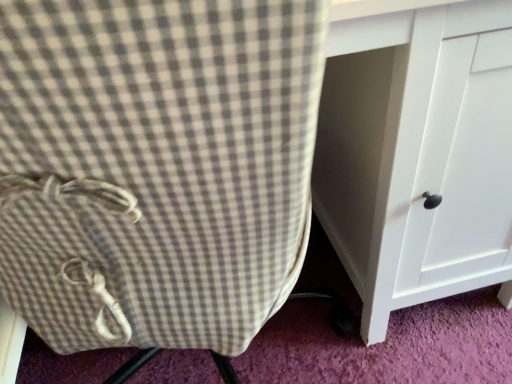
Describe the element at coordinates (464, 172) in the screenshot. I see `white matte drawer at right` at that location.

Where is `white matte drawer at right`? The height and width of the screenshot is (384, 512). white matte drawer at right is located at coordinates (464, 172).

The width and height of the screenshot is (512, 384). I want to click on white matte drawer at right, so click(x=464, y=172).